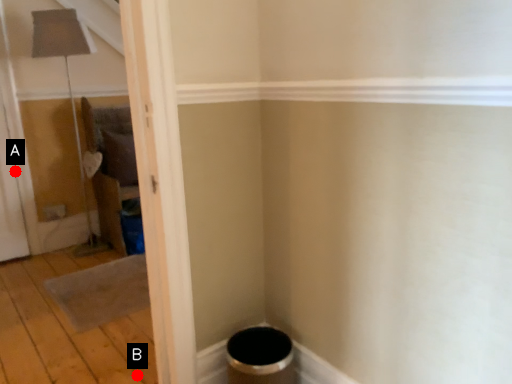
Question: Two points are circled on the image, labeled by A and B beside each circle. Which point is closer to the camera?

Choices:
 (A) A is closer
 (B) B is closer

Answer: (B)